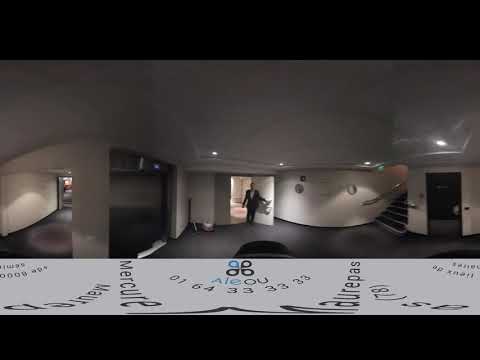
Find the location of a particular element. This screenshot has height=360, width=480. cieling is located at coordinates (285, 110).